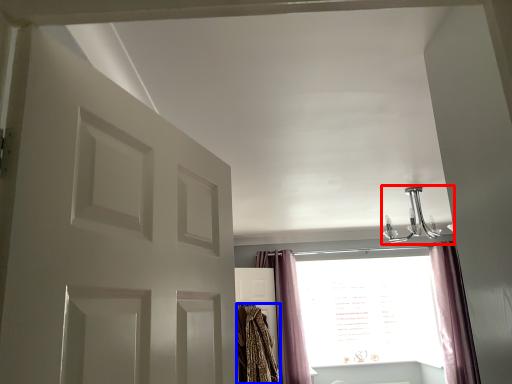
Question: Which point is closer to the camera, light fixture (highlighted by a red box) or blanket (highlighted by a blue box)?

Choices:
 (A) light fixture
 (B) blanket

Answer: (A)